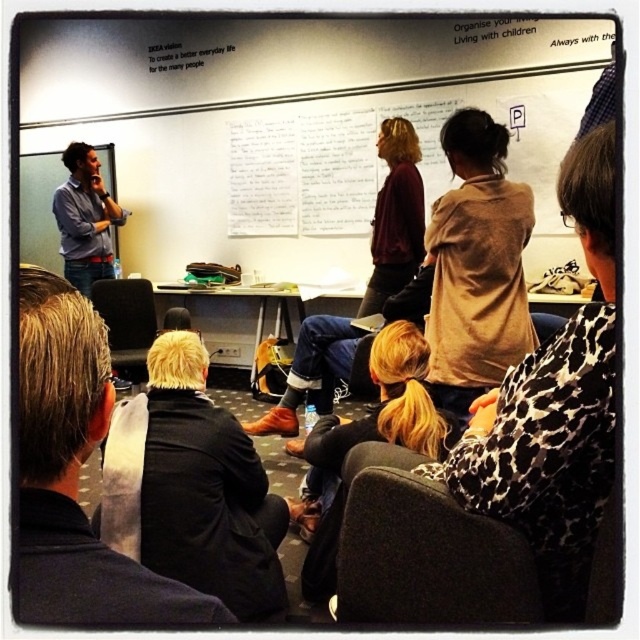
You are an attendee at this workshop and want to take a photo of the presenter. The presenter is wearing the matte blue shirt at left and has dark brown hair at lower left. However, you notice that one of these features is smaller in the image. Which feature should you focus on to ensure the photo captures both the shirt and hair clearly?

The dark brown hair at lower left is smaller than the matte blue shirt at left. To ensure both are captured clearly, focus on the matte blue shirt at left since it is larger and easier to frame in the photo.

Looking at this image, in the scene of a professional workshop, there is a person with dark brown hair at lower left and someone wearing a matte blue shirt at left. Which object has a smaller width?

The dark brown hair at lower left has a lesser width compared to the matte blue shirt at left.